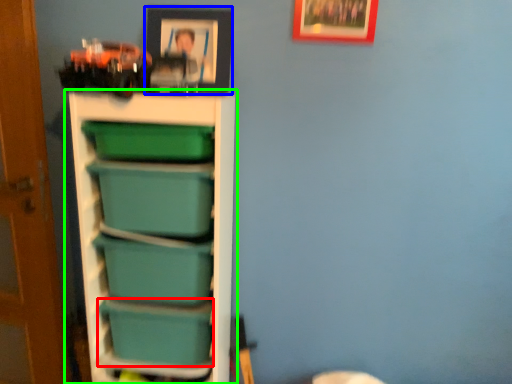
Question: Which object is positioned closest to box (highlighted by a red box)? Select from picture frame (highlighted by a blue box) and shelf (highlighted by a green box).

Choices:
 (A) picture frame
 (B) shelf

Answer: (B)